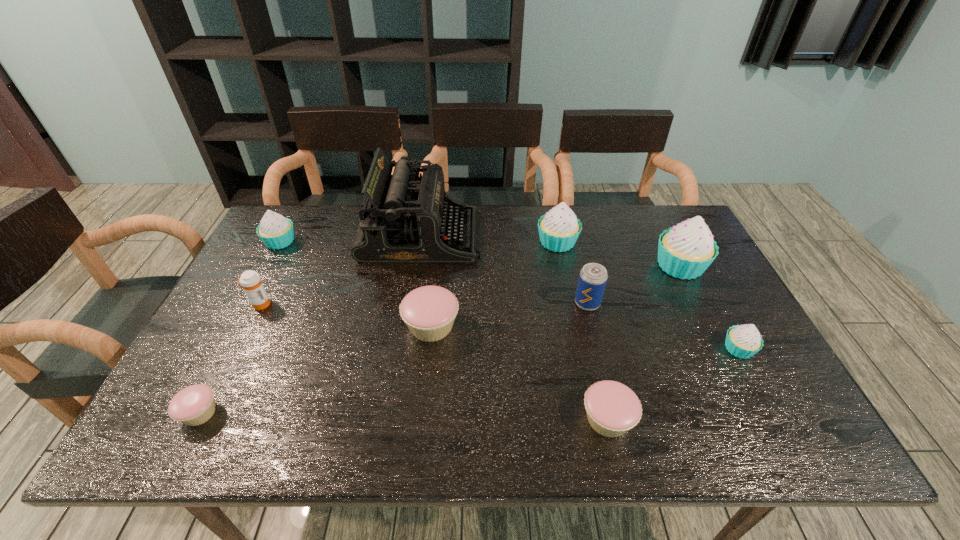
I want to click on object present at the far right corner, so click(685, 251).

At what (x,y) coordinates should I click in order to perform the action: click on vacant space at the far edge of the desktop. Please return your answer as a coordinate pair (x, y). Image resolution: width=960 pixels, height=540 pixels. Looking at the image, I should click on (631, 207).

In the image, there is a desktop. At what (x,y) coordinates should I click in order to perform the action: click on blank space at the near edge. Please return your answer as a coordinate pair (x, y). The image size is (960, 540). Looking at the image, I should click on (323, 433).

Find the location of a particular element. This screenshot has width=960, height=540. free point at the left edge is located at coordinates (267, 340).

At what (x,y) coordinates should I click in order to perform the action: click on vacant area that lies between the tallest object and the beer can. Please return your answer as a coordinate pair (x, y). Looking at the image, I should click on (504, 269).

Locate an element on the screen. vacant point located between the rightmost pink cupcake and the beer can is located at coordinates (597, 361).

In order to click on free spot between the smallest white cupcake and the beer can in this screenshot , I will do `click(663, 326)`.

Where is `empty location between the beer can and the sixth shortest cupcake`? empty location between the beer can and the sixth shortest cupcake is located at coordinates 572,273.

What are the coordinates of `free space between the orange medicine and the fifth shortest cupcake` in the screenshot? It's located at (270, 273).

Locate an element on the screen. free spot between the tallest object and the shortest object is located at coordinates (310, 324).